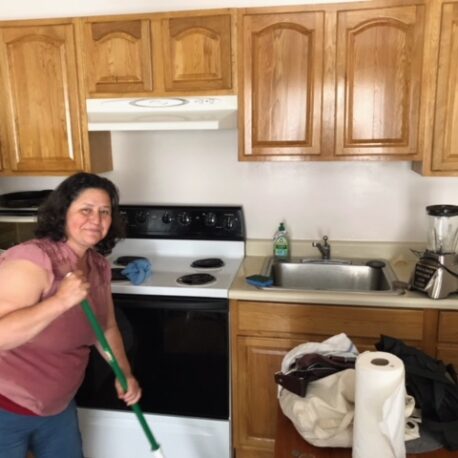
The width and height of the screenshot is (458, 458). I want to click on mop handle, so click(97, 333).